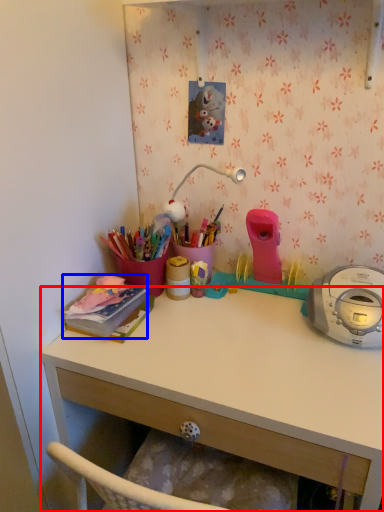
Question: Which object is closer to the camera taking this photo, desk (highlighted by a red box) or office supplies (highlighted by a blue box)?

Choices:
 (A) desk
 (B) office supplies

Answer: (A)